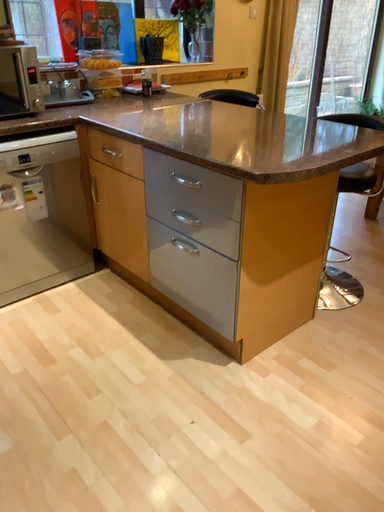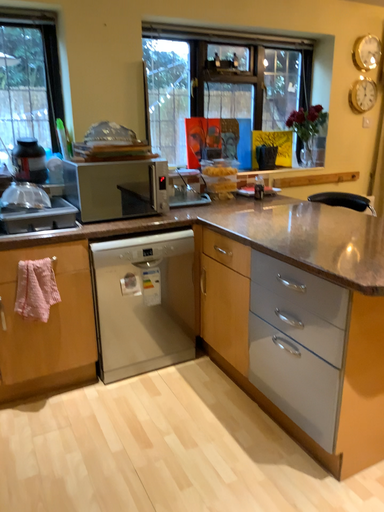
Question: Which way did the camera rotate in the video?

Choices:
 (A) rotated downward
 (B) rotated upward

Answer: (B)